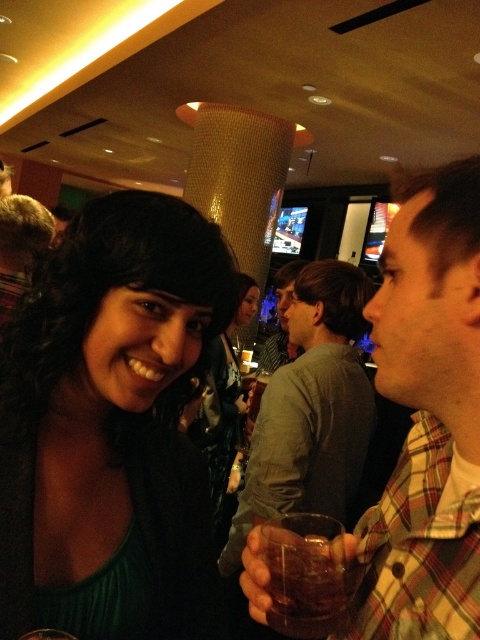
Question: Is plaid fabric shirt at right above translucent glass at lower right?

Choices:
 (A) yes
 (B) no

Answer: (A)

Question: Among these points, which one is farthest from the camera?

Choices:
 (A) (313, 296)
 (B) (64, 508)
 (C) (307, 602)

Answer: (A)

Question: Which of the following is the farthest from the observer?

Choices:
 (A) plaid fabric shirt at right
 (B) green matte dress at center
 (C) translucent glass at center

Answer: (C)

Question: Which point is farther from the camera taking this photo?

Choices:
 (A) (236, 381)
 (B) (60, 548)

Answer: (A)

Question: Does translucent glass at lower right appear under translucent glass at center?

Choices:
 (A) no
 (B) yes

Answer: (A)

Question: Can you confirm if green matte dress at center is positioned to the left of gray matte shirt at center?

Choices:
 (A) yes
 (B) no

Answer: (A)